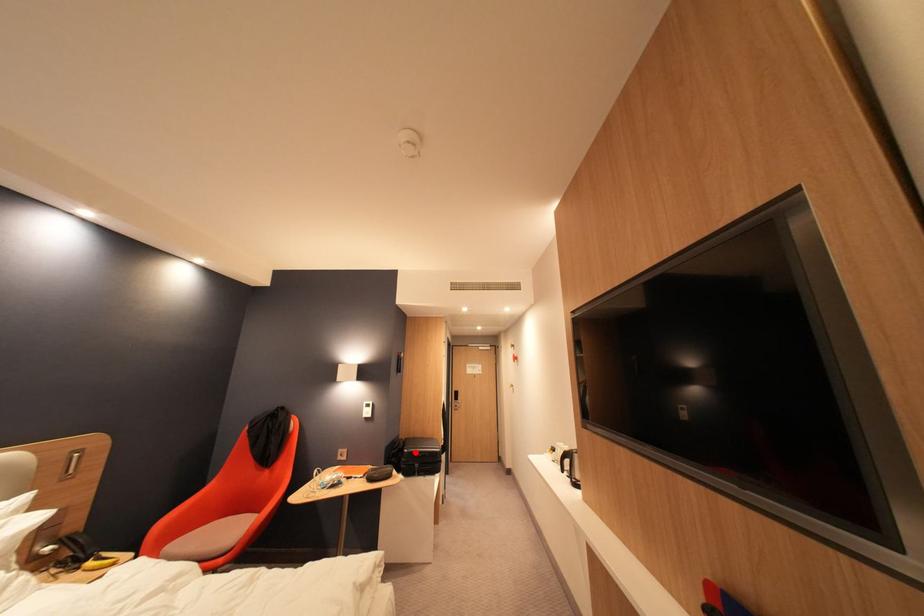
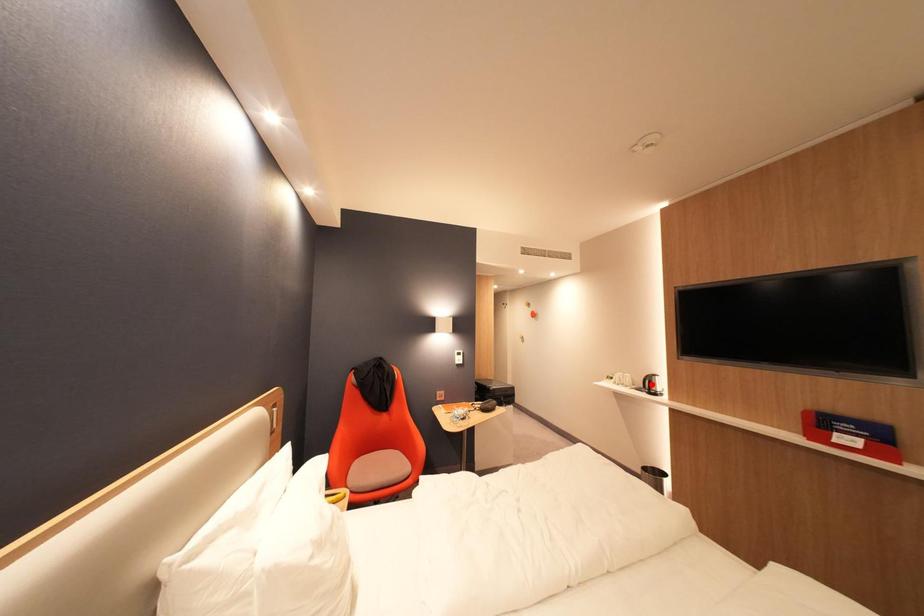
I am providing you with two images of the same scene from different viewpoints. A red point is marked on the first image and another point is marked on the second image. Do the highlighted points in image1 and image2 indicate the same real-world spot?

No